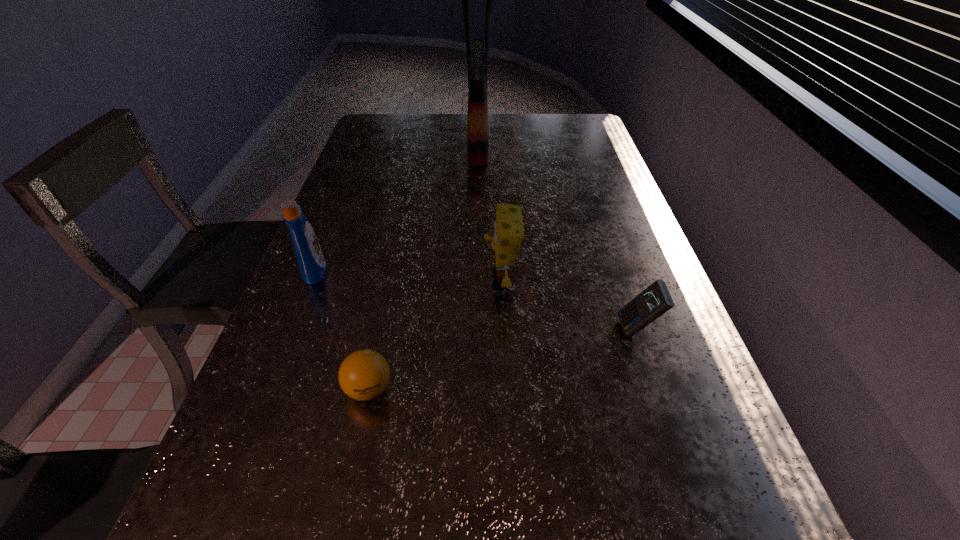
At what (x,y) coordinates should I click in order to perform the action: click on empty location between the third tallest object and the fourth object from right to left. Please return your answer as a coordinate pair (x, y). The height and width of the screenshot is (540, 960). Looking at the image, I should click on (435, 334).

Find the location of a particular element. free space between the shopping bag and the second shortest object is located at coordinates (558, 235).

Identify which object is the third closest to the detergent. Please provide its 2D coordinates. Your answer should be formatted as a tuple, i.e. [(x, y)], where the tuple contains the x and y coordinates of a point satisfying the conditions above.

[(477, 55)]

Select which object appears as the third closest to the leftmost object. Please provide its 2D coordinates. Your answer should be formatted as a tuple, i.e. [(x, y)], where the tuple contains the x and y coordinates of a point satisfying the conditions above.

[(477, 55)]

At what (x,y) coordinates should I click in order to perform the action: click on free space in the image that satisfies the following two spatial constraints: 1. on the face of the third shortest object; 2. on the side with brand of the shortest object. Please return your answer as a coordinate pair (x, y). Looking at the image, I should click on (507, 389).

You are a GUI agent. You are given a task and a screenshot of the screen. Output one action in this format:
    pyautogui.click(x=<x>, y=<y>)
    Task: Click on the vacant space that satisfies the following two spatial constraints: 1. on the front-facing side of the farthest object; 2. on the side with brand of the ping-pong ball
    This screenshot has height=540, width=960.
    Given the screenshot: What is the action you would take?
    pyautogui.click(x=476, y=389)

Image resolution: width=960 pixels, height=540 pixels. In order to click on blank area in the image that satisfies the following two spatial constraints: 1. on the front-facing side of the fourth farthest object; 2. on the side with brand of the shortest object in this screenshot , I will do `click(657, 389)`.